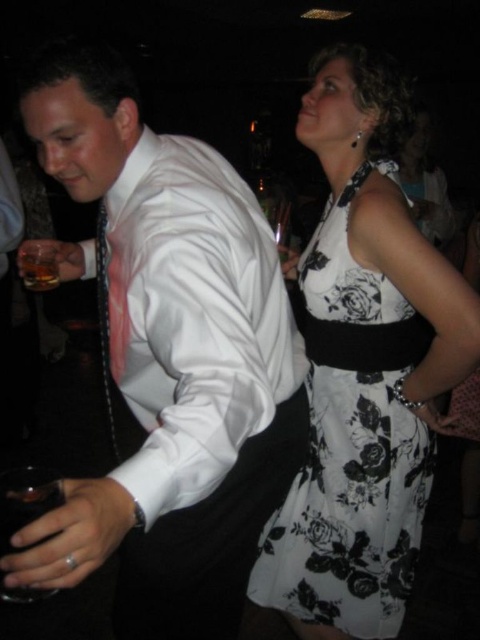
You are a photographer at a party and want to capture a candid shot of the black floral dress at upper right and the transparent glass at lower left. The camera you are using has a maximum focus range of 25 inches. Can you take a photo of both objects without moving your position?

The black floral dress at upper right is 28.70 inches away from the transparent glass at lower left, which exceeds the camera maximum focus range of 25 inches. Therefore, you cannot capture both objects in focus without moving your position.

Based on the scene description, where is the black floral dress at upper right located in terms of its 2D coordinates?

The black floral dress at upper right is located at the 2D coordinates of point (350,449).